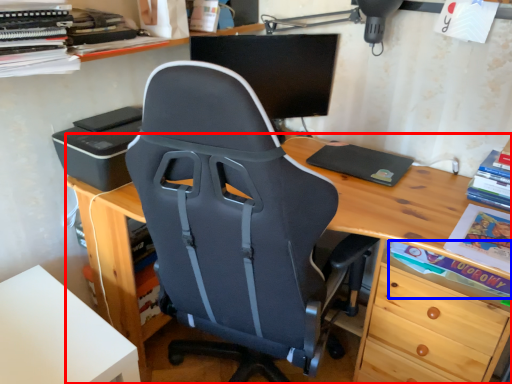
Question: Which object appears closest to the camera in this image, desk (highlighted by a red box) or book (highlighted by a blue box)?

Choices:
 (A) desk
 (B) book

Answer: (A)